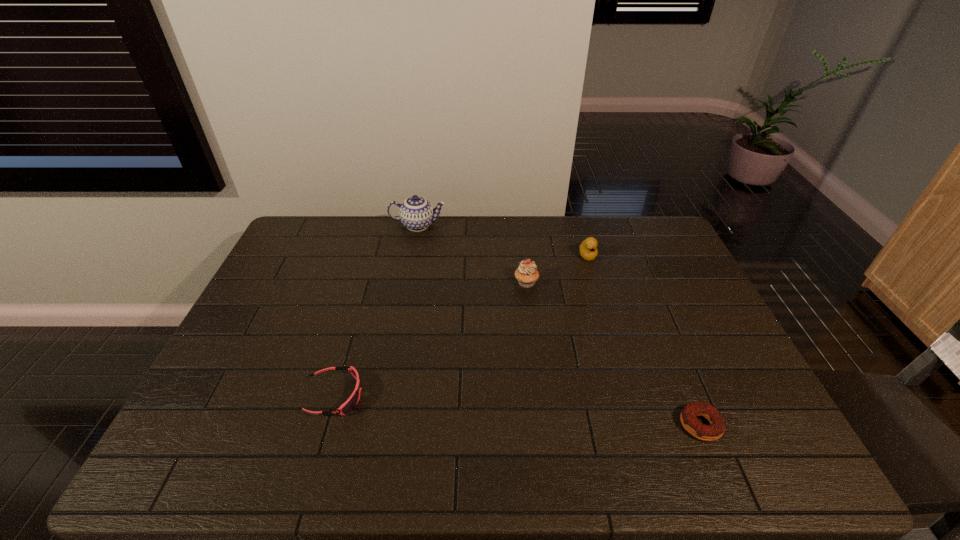
The width and height of the screenshot is (960, 540). In order to click on vacant area at the near edge of the desktop in this screenshot , I will do `click(242, 463)`.

Image resolution: width=960 pixels, height=540 pixels. Identify the location of free space at the left edge. (290, 272).

I want to click on vacant position at the right edge of the desktop, so click(x=695, y=291).

The height and width of the screenshot is (540, 960). Identify the location of free space at the far left corner of the desktop. (317, 240).

Image resolution: width=960 pixels, height=540 pixels. Identify the location of blank region between the chinaware and the goggles. (376, 310).

Locate an element on the screen. free space between the third object from left to right and the goggles is located at coordinates (430, 339).

The width and height of the screenshot is (960, 540). Identify the location of free spot between the rightmost object and the duckling. (644, 340).

You are a GUI agent. You are given a task and a screenshot of the screen. Output one action in this format:
    pyautogui.click(x=<x>, y=<y>)
    Task: Click on the vacant point located between the shortest object and the goggles
    Image resolution: width=960 pixels, height=540 pixels.
    Given the screenshot: What is the action you would take?
    pyautogui.click(x=517, y=410)

Find the location of a particular element. The width and height of the screenshot is (960, 540). empty location between the duckling and the farthest object is located at coordinates (503, 240).

Find the location of a particular element. This screenshot has height=540, width=960. free space between the shortest object and the duckling is located at coordinates (644, 340).